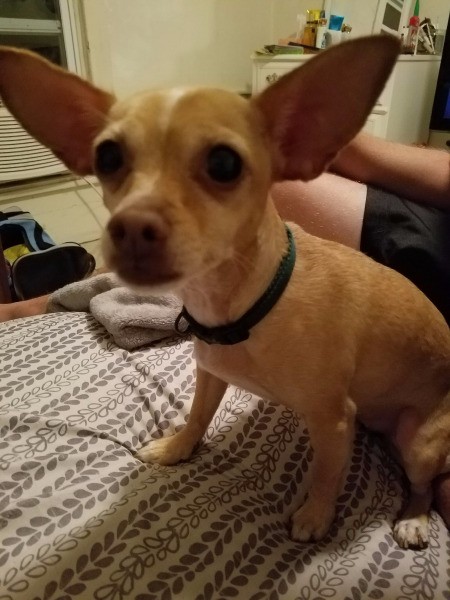
Identify the location of dresser. (421, 86).